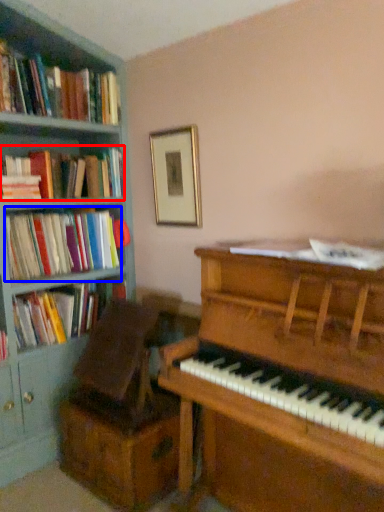
Question: Which point is further to the camera, book (highlighted by a red box) or book (highlighted by a blue box)?

Choices:
 (A) book
 (B) book

Answer: (B)